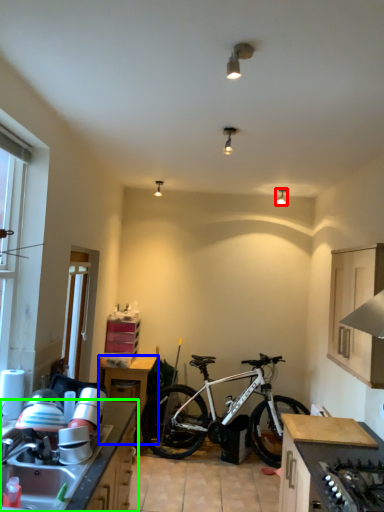
Question: Which object is positioned farthest from lamp (highlighted by a red box)? Select from table (highlighted by a blue box) and countertop (highlighted by a green box).

Choices:
 (A) table
 (B) countertop

Answer: (B)